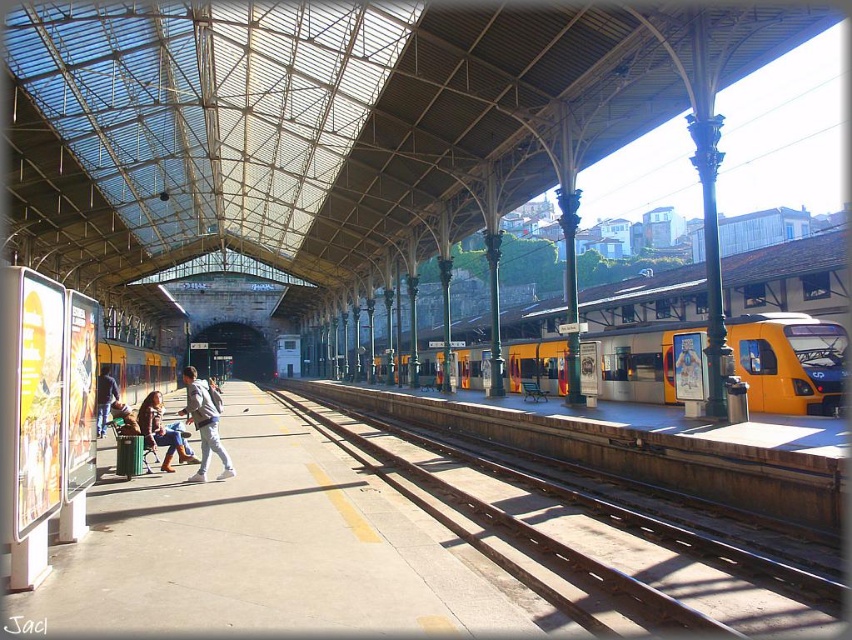
You are a photographer standing on the train station platform. You see a light brown leather jacket at center and a denim jacket at center. Which jacket is located to the right of the other?

The light brown leather jacket at center is positioned on the right side of denim jacket at center.

You are standing at the point marked as point [227,465] on the platform. You want to walk straight towards the tunnel at the far end of the station. Is there enough space between you and the tunnel for a person to walk comfortably?

The distance between point [227,465] and the viewer is 41.47 feet, so there is sufficient space for a person to walk comfortably towards the tunnel.